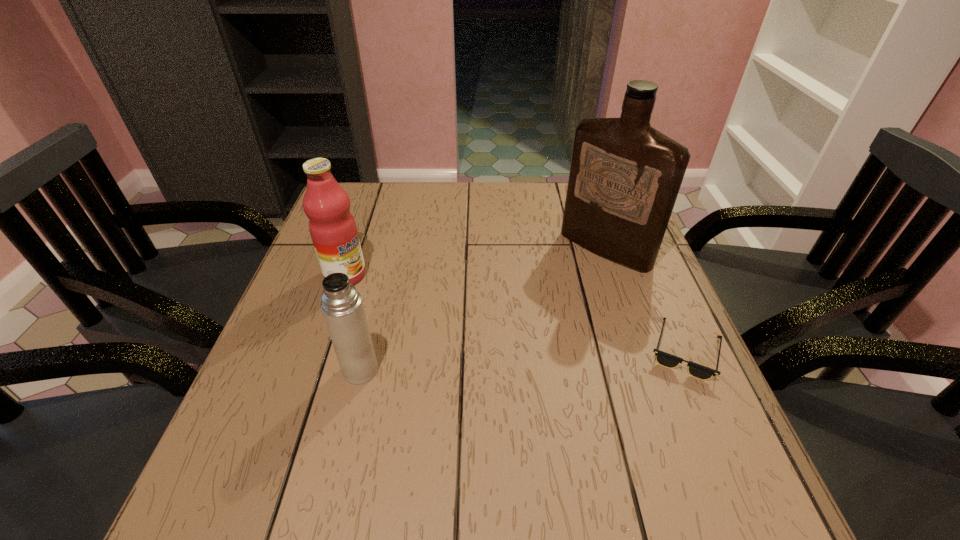
This screenshot has width=960, height=540. In order to click on vacant region at the right edge in this screenshot , I will do `click(668, 313)`.

Identify the location of vacant space at the far left corner. This screenshot has width=960, height=540. (357, 193).

The image size is (960, 540). I want to click on free space at the near left corner, so click(x=226, y=431).

The image size is (960, 540). Find the location of `vacant point located between the shortest object and the leftmost object`. vacant point located between the shortest object and the leftmost object is located at coordinates (516, 313).

You are a GUI agent. You are given a task and a screenshot of the screen. Output one action in this format:
    pyautogui.click(x=<x>, y=<y>)
    Task: Click on the vacant space that's between the liquor and the thermos bottle
    
    Given the screenshot: What is the action you would take?
    click(x=483, y=309)

I want to click on free space that is in between the shortest object and the second shortest object, so click(x=523, y=360).

Image resolution: width=960 pixels, height=540 pixels. I want to click on free space that is in between the shortest object and the liquor, so click(x=645, y=300).

You are a GUI agent. You are given a task and a screenshot of the screen. Output one action in this format:
    pyautogui.click(x=<x>, y=<y>)
    Task: Click on the vacant space in between the tallest object and the shortest object
    The height and width of the screenshot is (540, 960).
    Given the screenshot: What is the action you would take?
    pyautogui.click(x=645, y=300)

Where is `free space between the shortest object and the leftmost object`? This screenshot has height=540, width=960. free space between the shortest object and the leftmost object is located at coordinates (516, 313).

Locate an element on the screen. free spot between the sunglasses and the tallest object is located at coordinates click(645, 300).